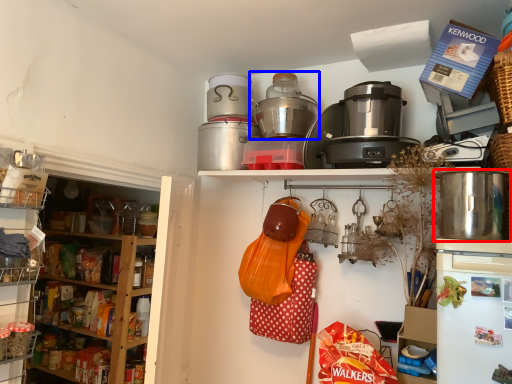
Question: Among these objects, which one is farthest to the camera, kitchen appliance (highlighted by a red box) or rice cooker (highlighted by a blue box)?

Choices:
 (A) kitchen appliance
 (B) rice cooker

Answer: (B)